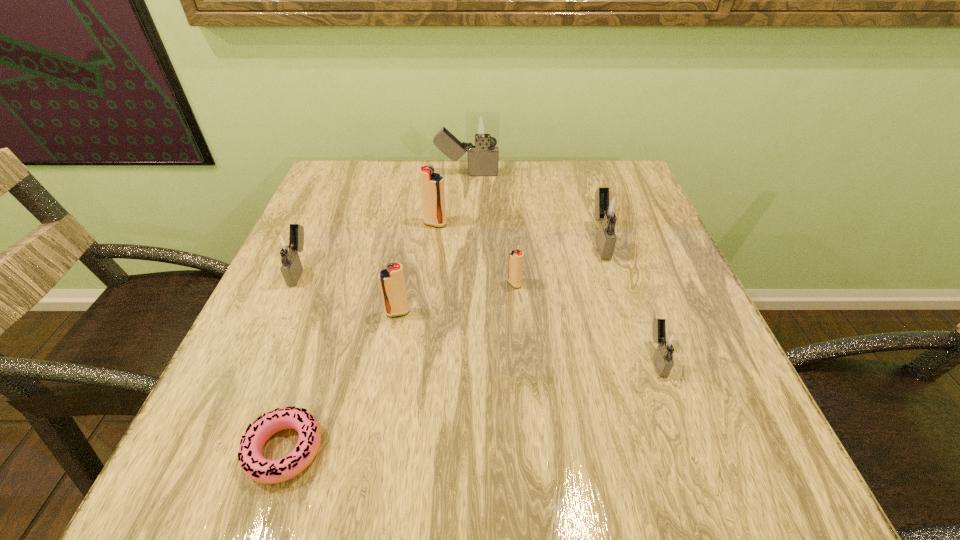
Locate which red igniter is the third closest to the tallest igniter. Please provide its 2D coordinates. Your answer should be formatted as a tuple, i.e. [(x, y)], where the tuple contains the x and y coordinates of a point satisfying the conditions above.

[(392, 283)]

The image size is (960, 540). Identify the location of red igniter that is the second nearest to the third smallest gray igniter. (431, 184).

You are a GUI agent. You are given a task and a screenshot of the screen. Output one action in this format:
    pyautogui.click(x=<x>, y=<y>)
    Task: Click on the blank space that satisfies the following two spatial constraints: 1. on the back side of the leftmost object; 2. on the left side of the farthest igniter
    This screenshot has width=960, height=540.
    Given the screenshot: What is the action you would take?
    pyautogui.click(x=343, y=174)